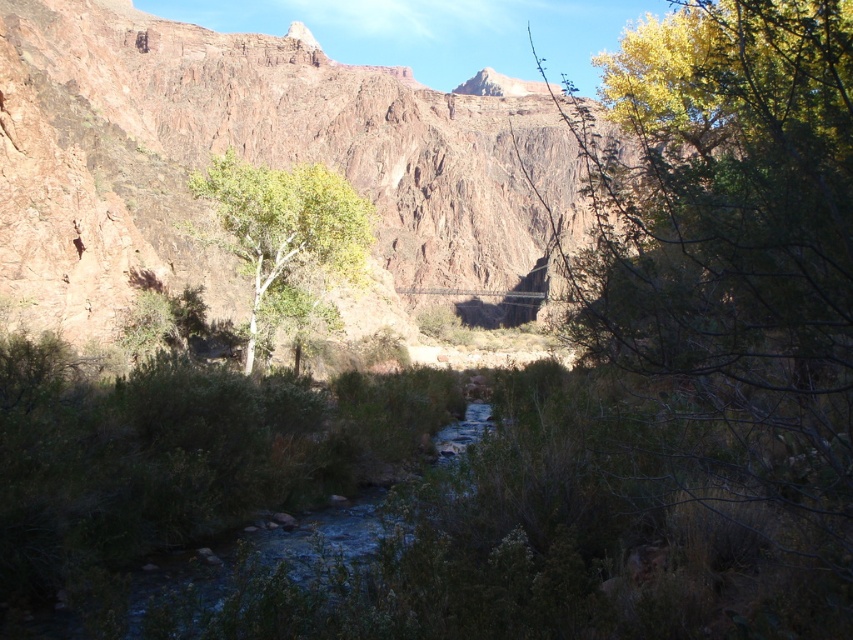
Which of these two, rustic rock mountain at center or green leafy tree at center, stands taller?

rustic rock mountain at center is taller.

The width and height of the screenshot is (853, 640). I want to click on rustic rock mountain at center, so click(x=254, y=163).